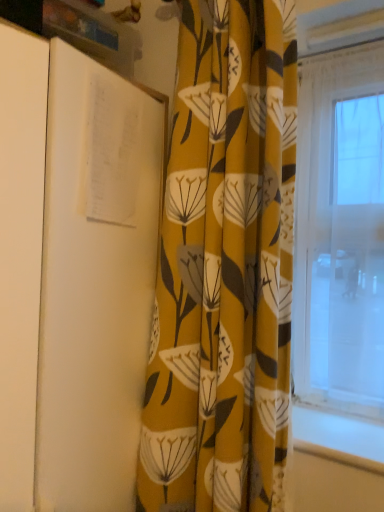
Question: From a real-world perspective, does white paper at left stand above yellow floral fabric curtain at center?

Choices:
 (A) yes
 (B) no

Answer: (B)

Question: From the image's perspective, would you say white paper at left is positioned over yellow floral fabric curtain at center?

Choices:
 (A) yes
 (B) no

Answer: (B)

Question: Is white paper at left facing away from yellow floral fabric curtain at center?

Choices:
 (A) yes
 (B) no

Answer: (B)

Question: From the image's perspective, is white paper at left below yellow floral fabric curtain at center?

Choices:
 (A) yes
 (B) no

Answer: (A)

Question: Is white paper at left smaller than yellow floral fabric curtain at center?

Choices:
 (A) no
 (B) yes

Answer: (A)

Question: Considering the relative sizes of white paper at left and yellow floral fabric curtain at center in the image provided, is white paper at left shorter than yellow floral fabric curtain at center?

Choices:
 (A) yes
 (B) no

Answer: (A)

Question: Does yellow floral fabric curtain at center have a greater height compared to white paper at left?

Choices:
 (A) no
 (B) yes

Answer: (B)

Question: Does yellow floral fabric curtain at center lie in front of white paper at left?

Choices:
 (A) no
 (B) yes

Answer: (A)

Question: From the image's perspective, is yellow floral fabric curtain at center above white paper at left?

Choices:
 (A) no
 (B) yes

Answer: (B)

Question: Can you confirm if yellow floral fabric curtain at center is thinner than white paper at left?

Choices:
 (A) yes
 (B) no

Answer: (A)

Question: Can you confirm if yellow floral fabric curtain at center is positioned to the left of white paper at left?

Choices:
 (A) yes
 (B) no

Answer: (B)

Question: Can you confirm if yellow floral fabric curtain at center is smaller than white paper at left?

Choices:
 (A) no
 (B) yes

Answer: (B)

Question: In terms of size, does yellow floral fabric curtain at center appear bigger or smaller than white paper at left?

Choices:
 (A) big
 (B) small

Answer: (B)